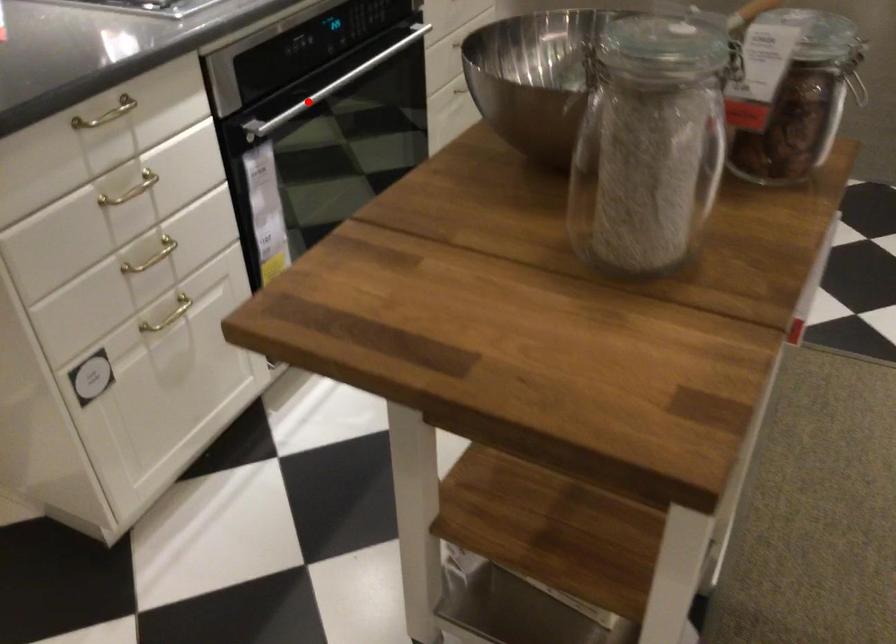
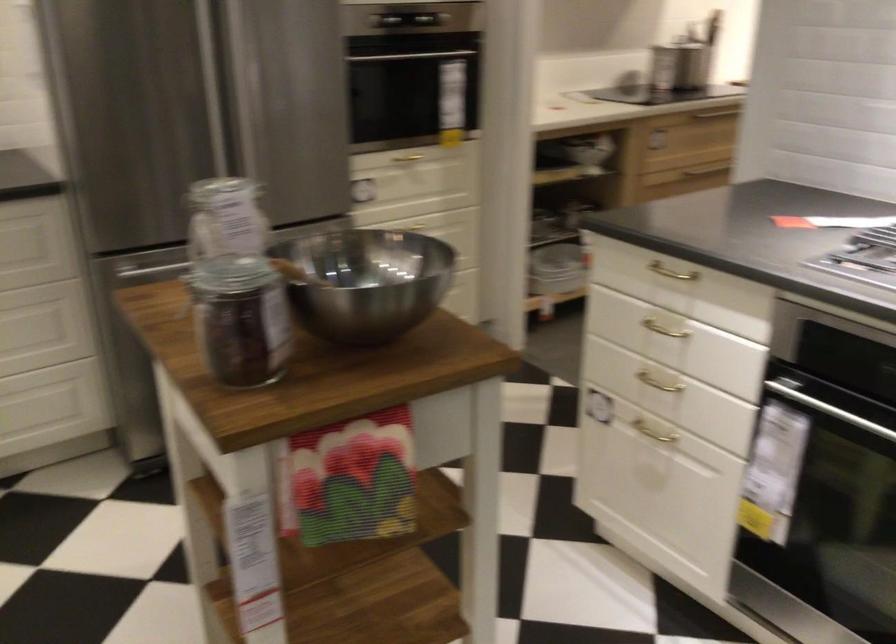
Question: I am providing you with two images of the same scene from different viewpoints. In image1, a red point is highlighted. Considering the same 3D point in image2, which of the following is correct?

Choices:
 (A) It is closer
 (B) It is farther

Answer: (A)